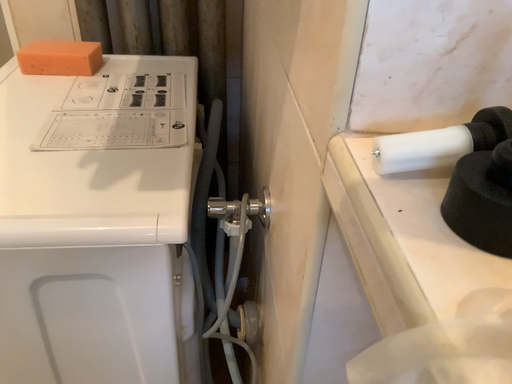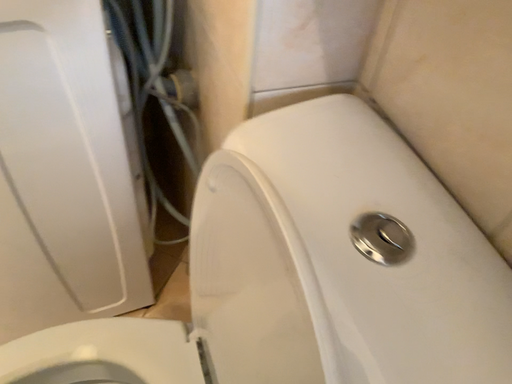
Question: How did the camera likely rotate when shooting the video?

Choices:
 (A) rotated right
 (B) rotated left

Answer: (A)